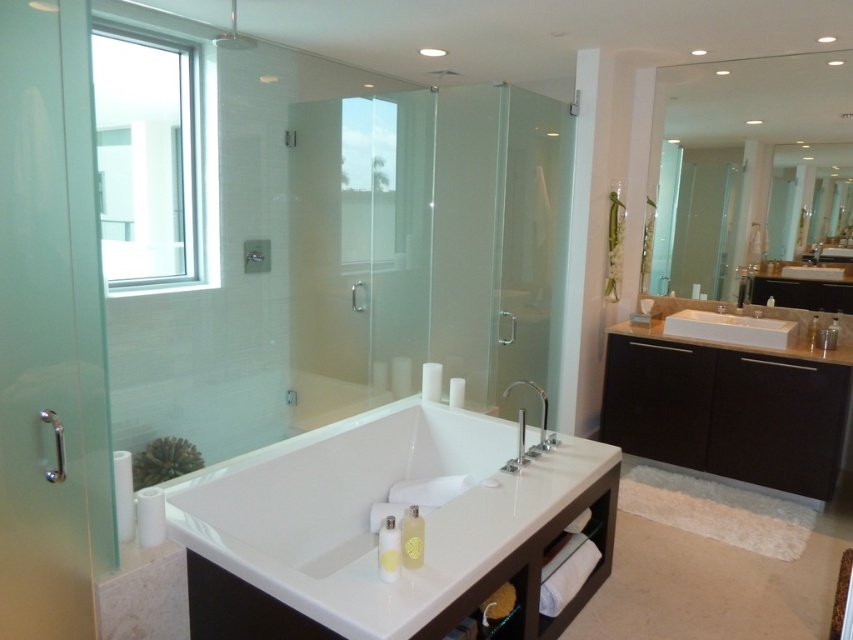
Question: Is white glossy bathtub at center above polished chrome faucet at center?

Choices:
 (A) no
 (B) yes

Answer: (A)

Question: Considering the relative positions of white glossy rectangular sink at right and satin nickel grab bar at lower left in the image provided, where is white glossy rectangular sink at right located with respect to satin nickel grab bar at lower left?

Choices:
 (A) below
 (B) above

Answer: (B)

Question: Which is farther from the satin nickel grab bar at lower left?

Choices:
 (A) satin nickel faucet at right
 (B) white glossy bathtub at center
 (C) dark brown wood vanity at right
 (D) clear glass mirror at upper right

Answer: (D)

Question: Can you confirm if white glossy bathtub at center is positioned to the right of transparent glass shower door at left?

Choices:
 (A) no
 (B) yes

Answer: (B)

Question: Which of the following is the closest to the observer?

Choices:
 (A) pyautogui.click(x=740, y=381)
 (B) pyautogui.click(x=84, y=176)
 (C) pyautogui.click(x=543, y=426)
 (D) pyautogui.click(x=722, y=202)

Answer: (B)

Question: Among these objects, which one is nearest to the camera?

Choices:
 (A) polished chrome faucet at center
 (B) satin nickel grab bar at lower left
 (C) white glossy rectangular sink at right
 (D) satin nickel faucet at right

Answer: (B)